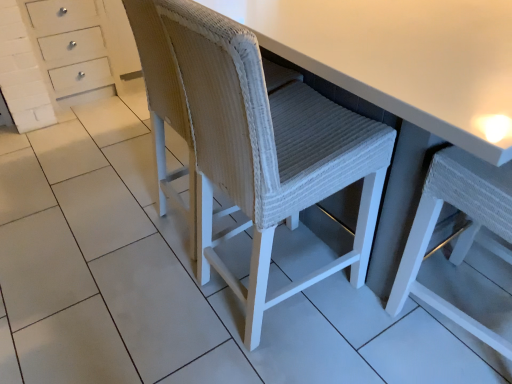
Question: Considering the relative sizes of white woven chair at center, which appears as the first chair when viewed from the left, and white woven stool at center in the image provided, is white woven chair at center, which appears as the first chair when viewed from the left, smaller than white woven stool at center?

Choices:
 (A) no
 (B) yes

Answer: (B)

Question: Is the position of white woven chair at center, which appears as the first chair when viewed from the left, less distant than that of white woven stool at center?

Choices:
 (A) yes
 (B) no

Answer: (B)

Question: Can you confirm if white woven chair at center, the 2th chair viewed from the right, is positioned to the right of white woven stool at center?

Choices:
 (A) no
 (B) yes

Answer: (A)

Question: Does white woven chair at center, which appears as the first chair when viewed from the left, have a lesser height compared to white woven stool at center?

Choices:
 (A) no
 (B) yes

Answer: (A)

Question: From the image's perspective, is white woven chair at center, which appears as the first chair when viewed from the left, above white woven stool at center?

Choices:
 (A) yes
 (B) no

Answer: (B)

Question: From the image's perspective, relative to white woven chair at center, which is the 2th chair from left to right, is white woven stool at center above or below?

Choices:
 (A) below
 (B) above

Answer: (B)

Question: Looking at the image, does white woven stool at center seem bigger or smaller compared to white woven chair at center, which is the 2th chair from left to right?

Choices:
 (A) small
 (B) big

Answer: (B)

Question: Considering their positions, is white woven stool at center located in front of or behind white woven chair at center, which ranks as the 1th chair in right-to-left order?

Choices:
 (A) behind
 (B) front

Answer: (A)

Question: Is point (424, 162) positioned closer to the camera than point (482, 213)?

Choices:
 (A) farther
 (B) closer

Answer: (A)

Question: Considering the positions of white woven swivel chair at center and white woven chair at center, which appears as the first chair when viewed from the left, in the image, is white woven swivel chair at center wider or thinner than white woven chair at center, which appears as the first chair when viewed from the left,?

Choices:
 (A) wide
 (B) thin

Answer: (B)

Question: Looking at the image, does white woven swivel chair at center seem bigger or smaller compared to white woven chair at center, which appears as the first chair when viewed from the left?

Choices:
 (A) big
 (B) small

Answer: (B)

Question: Is white woven swivel chair at center situated inside white woven chair at center, which appears as the first chair when viewed from the left, or outside?

Choices:
 (A) outside
 (B) inside

Answer: (A)

Question: Considering the positions of point (151, 87) and point (214, 77), is point (151, 87) closer or farther from the camera than point (214, 77)?

Choices:
 (A) farther
 (B) closer

Answer: (A)

Question: From a real-world perspective, is white woven chair at center, which is the 2th chair from left to right, physically located above or below white woven stool at center?

Choices:
 (A) below
 (B) above

Answer: (B)

Question: Is white woven chair at center, which ranks as the 1th chair in right-to-left order, in front of or behind white woven stool at center in the image?

Choices:
 (A) front
 (B) behind

Answer: (A)